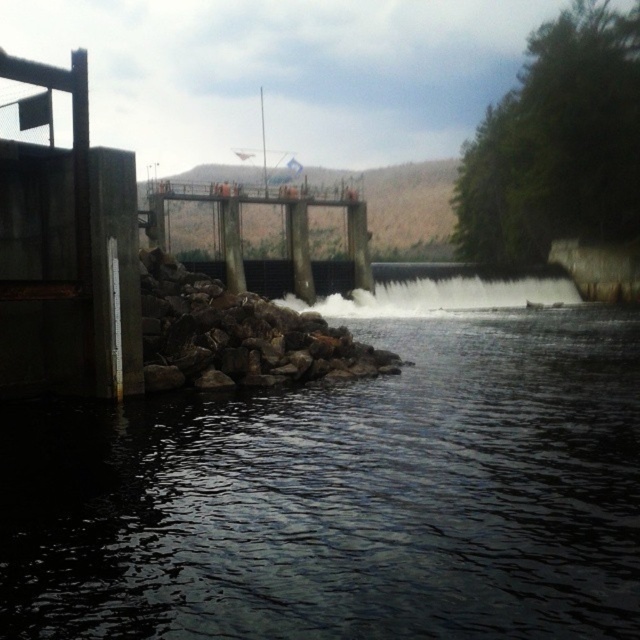
In the scene shown: You are a safety inspector at the dam and need to ensure there is enough space between the dark gray water at lower left and the rocky pile at lower left for a 5 meter safety buffer. Based on the scene, is the current distance sufficient?

The dark gray water at lower left and rocky pile at lower left are 5.17 meters apart from each other. Since 5.17 meters is greater than 5 meters, the safety buffer requirement is met.

You are a safety inspector at the dam and need to ensure that the dark gray water at lower left and the rocky pile at lower left are within safe proximity. Based on the scene, which object takes up more space in the image?

The rocky pile at lower left takes up more space in the image than the dark gray water at lower left.